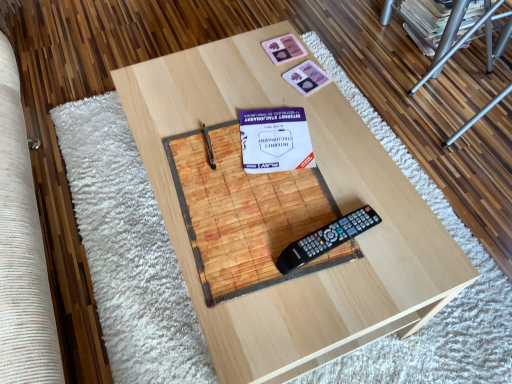
Question: Is black plastic remote control at center thinner than wooden table at center?

Choices:
 (A) yes
 (B) no

Answer: (A)

Question: Can you confirm if black plastic remote control at center is wider than wooden table at center?

Choices:
 (A) no
 (B) yes

Answer: (A)

Question: Is black plastic remote control at center aimed at wooden table at center?

Choices:
 (A) no
 (B) yes

Answer: (A)

Question: Is black plastic remote control at center far from wooden table at center?

Choices:
 (A) no
 (B) yes

Answer: (A)

Question: From the image's perspective, is black plastic remote control at center over wooden table at center?

Choices:
 (A) no
 (B) yes

Answer: (A)

Question: From a real-world perspective, is black plastic remote control at center positioned above or below wooden table at center?

Choices:
 (A) below
 (B) above

Answer: (B)

Question: Is black plastic remote control at center taller or shorter than wooden table at center?

Choices:
 (A) tall
 (B) short

Answer: (B)

Question: In the image, is black plastic remote control at center positioned in front of or behind wooden table at center?

Choices:
 (A) front
 (B) behind

Answer: (B)

Question: Considering the positions of black plastic remote control at center and wooden table at center in the image, is black plastic remote control at center wider or thinner than wooden table at center?

Choices:
 (A) wide
 (B) thin

Answer: (B)

Question: Relative to wooden table at center, is pink matte coaster at upper center, arranged as the 1th square when viewed from the top, in front or behind?

Choices:
 (A) behind
 (B) front

Answer: (A)

Question: From the image's perspective, is pink matte coaster at upper center, placed as the 2th square when sorted from bottom to top, positioned above or below wooden table at center?

Choices:
 (A) above
 (B) below

Answer: (A)

Question: Looking at the image, does pink matte coaster at upper center, placed as the 2th square when sorted from bottom to top, seem bigger or smaller compared to wooden table at center?

Choices:
 (A) big
 (B) small

Answer: (B)

Question: From a real-world perspective, relative to wooden table at center, is pink matte coaster at upper center, placed as the 2th square when sorted from bottom to top, vertically above or below?

Choices:
 (A) below
 (B) above

Answer: (B)

Question: Considering their positions, is wooden table at center located in front of or behind matte cardboard magazine at upper right?

Choices:
 (A) behind
 (B) front

Answer: (B)

Question: Does point (324, 340) appear closer or farther from the camera than point (478, 3)?

Choices:
 (A) closer
 (B) farther

Answer: (A)